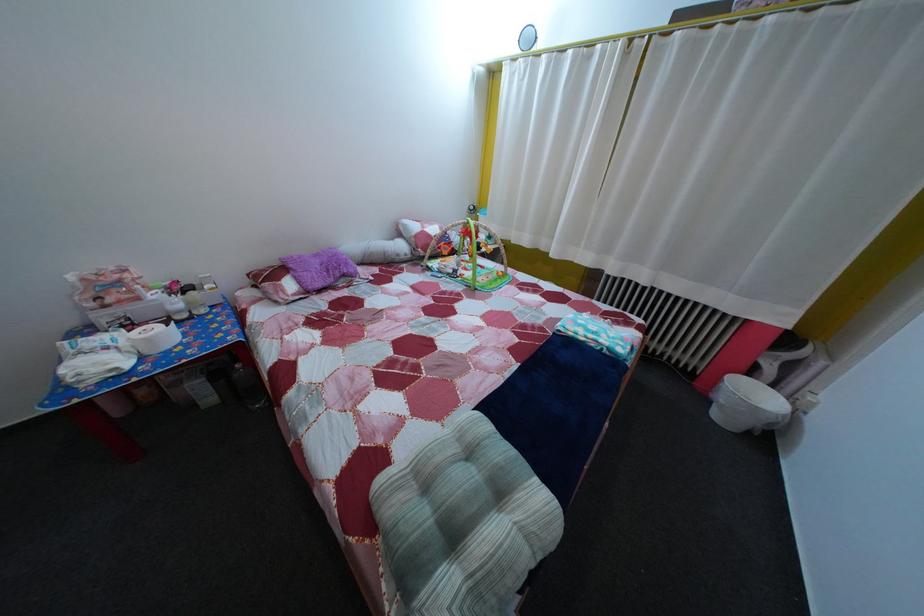
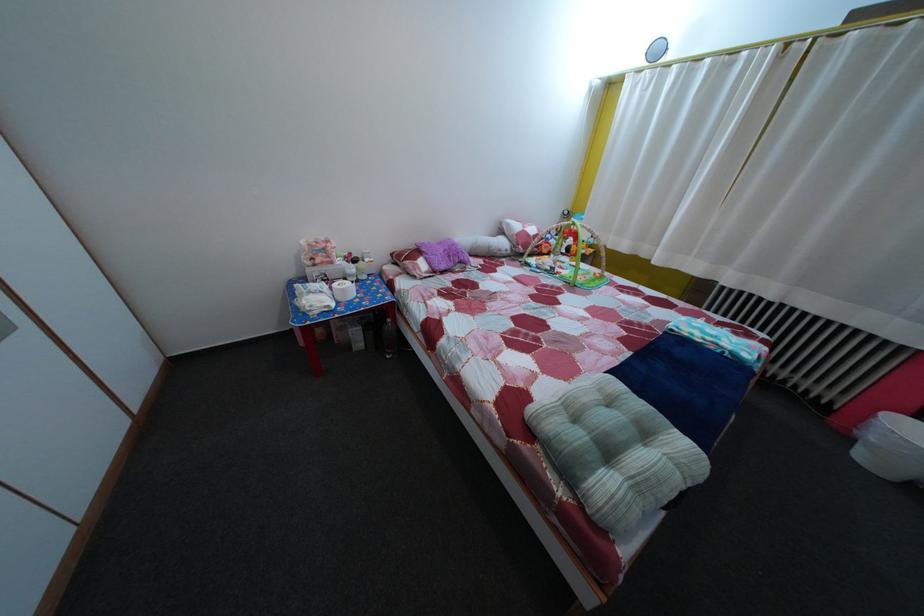
Find the pixel in the second image that matches the point at 325,262 in the first image.

(450, 252)